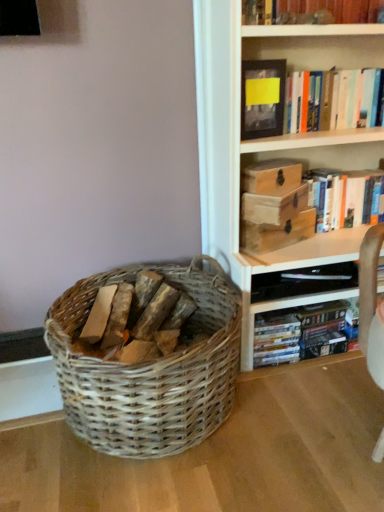
Describe the element at coordinates (346, 197) in the screenshot. The height and width of the screenshot is (512, 384). I see `hardcover book at upper right, which is the 1th book from bottom to top` at that location.

The height and width of the screenshot is (512, 384). What do you see at coordinates (332, 100) in the screenshot?
I see `hardcover book at upper right, marked as the second book in a top-to-bottom arrangement` at bounding box center [332, 100].

Identify the location of hardcover book at upper right, marked as the second book in a top-to-bottom arrangement. The height and width of the screenshot is (512, 384). (332, 100).

Describe the element at coordinates (292, 270) in the screenshot. The image size is (384, 512). I see `matte black shelf at lower right` at that location.

You are a GUI agent. You are given a task and a screenshot of the screen. Output one action in this format:
    pyautogui.click(x=<x>, y=<y>)
    Task: Click on the yellow paper at upper center
    
    Given the screenshot: What is the action you would take?
    pyautogui.click(x=262, y=98)

What do you see at coordinates (262, 98) in the screenshot? The width and height of the screenshot is (384, 512). I see `yellow paper at upper center` at bounding box center [262, 98].

How much space does wooden chest at upper right, which is counted as the 3th storage box, starting from the top, occupy horizontally?

The width of wooden chest at upper right, which is counted as the 3th storage box, starting from the top, is 7.96 inches.

Describe the element at coordinates (277, 233) in the screenshot. I see `wooden chest at upper right, positioned as the 1th storage box in bottom-to-top order` at that location.

The width and height of the screenshot is (384, 512). What do you see at coordinates (332, 9) in the screenshot?
I see `wooden book at upper right, which is the first book in top-to-bottom order` at bounding box center [332, 9].

Where is `hardcover book at upper right, which is the 3th book from top to bottom`? hardcover book at upper right, which is the 3th book from top to bottom is located at coordinates (346, 197).

Consider the image. Which is nearer, (290, 306) or (363, 109)?

Point (290, 306).

From the image's perspective, between matte black shelf at lower right and hardcover book at upper right, arranged as the second book when ordered from the bottom, which one is located above?

hardcover book at upper right, arranged as the second book when ordered from the bottom, from the image's perspective.

Find the location of a particular element. shelf lying behind the hardcover book at upper right, arranged as the second book when ordered from the bottom is located at coordinates (292, 270).

Is yellow paper at upper center at the back of wooden book at upper right, the 3th book in the bottom-to-top sequence?

wooden book at upper right, the 3th book in the bottom-to-top sequence, is not turned away from yellow paper at upper center.

Can you confirm if wooden book at upper right, the 3th book in the bottom-to-top sequence, is positioned to the left of yellow paper at upper center?

In fact, wooden book at upper right, the 3th book in the bottom-to-top sequence, is to the right of yellow paper at upper center.

Is point (291, 9) closer or farther from the camera than point (284, 96)?

Clearly, point (291, 9) is closer to the camera than point (284, 96).

Does wooden book at upper right, which is the first book in top-to-bottom order, have a greater width compared to yellow paper at upper center?

Indeed, wooden book at upper right, which is the first book in top-to-bottom order, has a greater width compared to yellow paper at upper center.

Locate an element on the screen. the 1st book directly above the wooden box at upper center, placed as the third storage box when sorted from bottom to top (from a real-world perspective) is located at coordinates (332, 100).

Considering the sizes of objects wooden box at upper center, placed as the third storage box when sorted from bottom to top, and hardcover book at upper right, marked as the second book in a top-to-bottom arrangement, in the image provided, who is shorter, wooden box at upper center, placed as the third storage box when sorted from bottom to top, or hardcover book at upper right, marked as the second book in a top-to-bottom arrangement,?

With less height is wooden box at upper center, placed as the third storage box when sorted from bottom to top.

Is the depth of wooden box at upper center, which ranks as the first storage box in top-to-bottom order, greater than that of hardcover book at upper right, marked as the second book in a top-to-bottom arrangement?

Yes, it is behind hardcover book at upper right, marked as the second book in a top-to-bottom arrangement.

Which object is positioned more to the left, wooden box at upper center, which ranks as the first storage box in top-to-bottom order, or hardcover book at upper right, arranged as the second book when ordered from the bottom?

From the viewer's perspective, wooden box at upper center, which ranks as the first storage box in top-to-bottom order, appears more on the left side.

Which object is further away from the camera, matte black shelf at lower right or wooden box at upper center, which is the 2th storage box from top to bottom?

matte black shelf at lower right is more distant.

How different are the orientations of matte black shelf at lower right and wooden box at upper center, which is the 2th storage box from top to bottom, in degrees?

The angle between the facing direction of matte black shelf at lower right and the facing direction of wooden box at upper center, which is the 2th storage box from top to bottom, is 36.8 degrees.

Which object is wider, matte black shelf at lower right or wooden box at upper center, which is the 2th storage box from top to bottom?

Wider between the two is matte black shelf at lower right.

Is wooden box at upper center, which ranks as the first storage box in top-to-bottom order, in contact with wooden box at upper center, which is counted as the 2th storage box, starting from the bottom?

Yes, wooden box at upper center, which ranks as the first storage box in top-to-bottom order, is right next to wooden box at upper center, which is counted as the 2th storage box, starting from the bottom, and making contact.

From a real-world perspective, who is located higher, wooden box at upper center, which ranks as the first storage box in top-to-bottom order, or wooden box at upper center, which is the 2th storage box from top to bottom?

wooden box at upper center, which ranks as the first storage box in top-to-bottom order, is physically above.

Which of these two, wooden box at upper center, which ranks as the first storage box in top-to-bottom order, or wooden box at upper center, which is the 2th storage box from top to bottom, stands taller?

wooden box at upper center, which is the 2th storage box from top to bottom, is taller.

Does woven wood basket at lower left lie in front of hardcover book at upper right, marked as the second book in a top-to-bottom arrangement?

Yes, woven wood basket at lower left is in front of hardcover book at upper right, marked as the second book in a top-to-bottom arrangement.

From the image's perspective, between woven wood basket at lower left and hardcover book at upper right, marked as the second book in a top-to-bottom arrangement, which one is located above?

From the image's view, hardcover book at upper right, marked as the second book in a top-to-bottom arrangement, is above.

Is hardcover book at upper right, marked as the second book in a top-to-bottom arrangement, completely or partially inside woven wood basket at lower left?

No, hardcover book at upper right, marked as the second book in a top-to-bottom arrangement, is located outside of woven wood basket at lower left.

Where is `picnic basket below the wooden box at upper center, which is the 2th storage box from top to bottom (from the image's perspective)`? picnic basket below the wooden box at upper center, which is the 2th storage box from top to bottom (from the image's perspective) is located at coordinates (151, 368).

Does wooden box at upper center, which is counted as the 2th storage box, starting from the bottom, contain woven wood basket at lower left?

No.

Is point (271, 220) positioned in front of point (136, 440)?

No, (271, 220) is further to viewer.

Is wooden box at upper center, which is the 2th storage box from top to bottom, turned away from woven wood basket at lower left?

No, wooden box at upper center, which is the 2th storage box from top to bottom, is not facing away from woven wood basket at lower left.

You are a GUI agent. You are given a task and a screenshot of the screen. Output one action in this format:
    pyautogui.click(x=<x>, y=<y>)
    Task: Click on the shelf below the hardcover book at upper right, arranged as the second book when ordered from the bottom (from a real-world perspective)
    
    Given the screenshot: What is the action you would take?
    pyautogui.click(x=292, y=270)

Where is `book that is the 2nd object above the yellow paper at upper center (from a real-world perspective)`? The image size is (384, 512). book that is the 2nd object above the yellow paper at upper center (from a real-world perspective) is located at coordinates (332, 9).

In the scene shown: Based on their spatial positions, is wooden box at upper center, which ranks as the first storage box in top-to-bottom order, or hardcover book at upper right, arranged as the second book when ordered from the bottom, closer to wooden chest at upper right, which is counted as the 3th storage box, starting from the top?

wooden box at upper center, which ranks as the first storage box in top-to-bottom order.

Which object lies nearer to the anchor point wooden box at upper center, which ranks as the first storage box in top-to-bottom order, wooden box at upper center, which is counted as the 2th storage box, starting from the bottom, or wooden chest at upper right, positioned as the 1th storage box in bottom-to-top order?

wooden box at upper center, which is counted as the 2th storage box, starting from the bottom, lies closer to wooden box at upper center, which ranks as the first storage box in top-to-bottom order, than the other object.

Based on their spatial positions, is wooden chest at upper right, positioned as the 1th storage box in bottom-to-top order, or wooden box at upper center, placed as the third storage box when sorted from bottom to top, closer to yellow paper at upper center?

wooden box at upper center, placed as the third storage box when sorted from bottom to top, is positioned closer to the anchor yellow paper at upper center.

Which object lies further to the anchor point yellow paper at upper center, wooden box at upper center, which ranks as the first storage box in top-to-bottom order, or matte black shelf at lower right?

matte black shelf at lower right is further to yellow paper at upper center.

Estimate the real-world distances between objects in this image. Which object is further from hardcover book at upper right, which is the 3th book from top to bottom, wooden chest at upper right, positioned as the 1th storage box in bottom-to-top order, or hardcover book at upper right, marked as the second book in a top-to-bottom arrangement?

hardcover book at upper right, marked as the second book in a top-to-bottom arrangement, is further to hardcover book at upper right, which is the 3th book from top to bottom.

Considering their positions, is matte black shelf at lower right positioned further to hardcover book at upper right, arranged as the second book when ordered from the bottom, than hardcover book at upper right, which is the 3th book from top to bottom?

Based on the image, matte black shelf at lower right appears to be further to hardcover book at upper right, arranged as the second book when ordered from the bottom.

From the image, which object appears to be nearer to matte black shelf at lower right, wooden box at upper center, which is counted as the 2th storage box, starting from the bottom, or wooden book at upper right, which is the first book in top-to-bottom order?

wooden box at upper center, which is counted as the 2th storage box, starting from the bottom.

Looking at this image, from the image, which object appears to be farther from wooden book at upper right, the 3th book in the bottom-to-top sequence, hardcover book at upper right, marked as the second book in a top-to-bottom arrangement, or woven wood basket at lower left?

woven wood basket at lower left lies further to wooden book at upper right, the 3th book in the bottom-to-top sequence, than the other object.

This screenshot has height=512, width=384. Find the location of `book situated between yellow paper at upper center and hardcover book at upper right, arranged as the second book when ordered from the bottom, from left to right`. book situated between yellow paper at upper center and hardcover book at upper right, arranged as the second book when ordered from the bottom, from left to right is located at coordinates (332, 9).

At what (x,y) coordinates should I click in order to perform the action: click on paperback book between wooden book at upper right, which is the first book in top-to-bottom order, and wooden box at upper center, placed as the third storage box when sorted from bottom to top, from top to bottom. Please return your answer as a coordinate pair (x, y). The image size is (384, 512). Looking at the image, I should click on (262, 98).

Identify the location of book between hardcover book at upper right, arranged as the second book when ordered from the bottom, and wooden chest at upper right, which is counted as the 3th storage box, starting from the top, in the vertical direction. (346, 197).

You are a GUI agent. You are given a task and a screenshot of the screen. Output one action in this format:
    pyautogui.click(x=<x>, y=<y>)
    Task: Click on the paperback book between wooden book at upper right, the 3th book in the bottom-to-top sequence, and wooden chest at upper right, positioned as the 1th storage box in bottom-to-top order, from top to bottom
    The width and height of the screenshot is (384, 512).
    Given the screenshot: What is the action you would take?
    pyautogui.click(x=262, y=98)